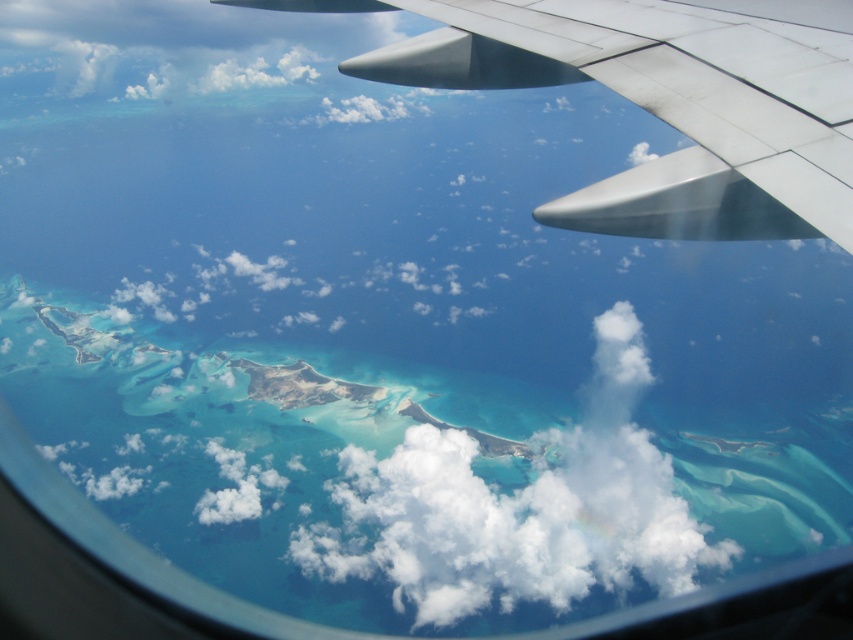
Question: Can you confirm if metallic silver wing at upper right is wider than white fluffy cloud at center?

Choices:
 (A) no
 (B) yes

Answer: (A)

Question: Which point is farther to the camera?

Choices:
 (A) (463, 32)
 (B) (531, 513)

Answer: (B)

Question: Is metallic silver wing at upper right wider than white fluffy cloud at center?

Choices:
 (A) yes
 (B) no

Answer: (B)

Question: Is metallic silver wing at upper right bigger than white fluffy cloud at center?

Choices:
 (A) yes
 (B) no

Answer: (B)